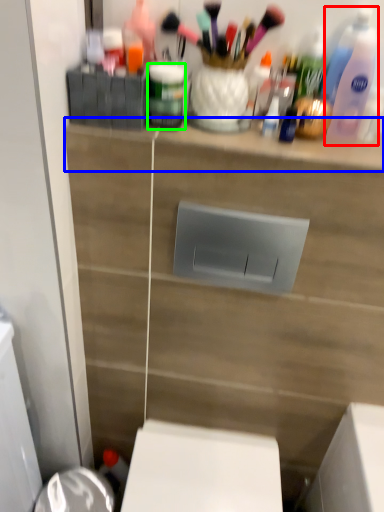
Question: Based on their relative distances, which object is farther from cleaning product (highlighted by a red box)? Choose from ledge (highlighted by a blue box) and toiletry (highlighted by a green box).

Choices:
 (A) ledge
 (B) toiletry

Answer: (B)